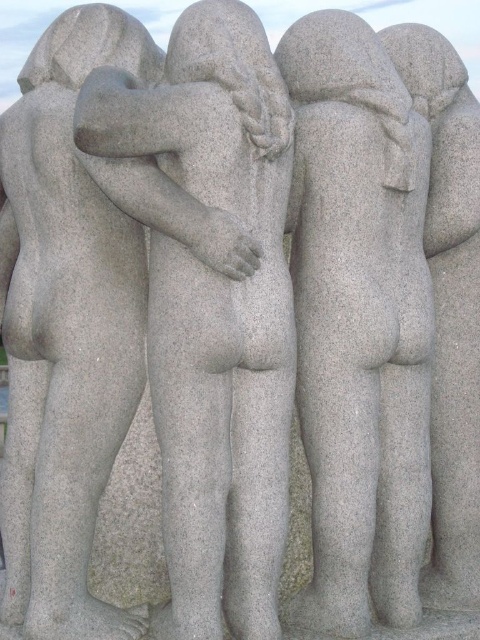
Consider the image. Is gray granite statue at center to the right of gray stone statue at center from the viewer's perspective?

Indeed, gray granite statue at center is positioned on the right side of gray stone statue at center.

In the scene shown: Who is shorter, gray granite statue at center or gray stone statue at center?

gray stone statue at center

This screenshot has height=640, width=480. Describe the element at coordinates (371, 294) in the screenshot. I see `gray granite statue at center` at that location.

Locate an element on the screen. gray granite statue at center is located at coordinates (371, 294).

Based on the photo, can you confirm if gray stone statue at center is positioned to the right of gray granite statue at left?

Yes, gray stone statue at center is to the right of gray granite statue at left.

Is gray stone statue at center thinner than gray granite statue at left?

No.

Between point (203, 484) and point (64, 221), which one is positioned behind?

Point (64, 221)

Identify the location of gray stone statue at center. This screenshot has height=640, width=480. (215, 314).

Can you confirm if gray granite statue at center is shorter than gray granite statue at left?

In fact, gray granite statue at center may be taller than gray granite statue at left.

Is point (386, 570) positioned after point (123, 278)?

Yes, it is behind point (123, 278).

Find the location of a particular element. The width and height of the screenshot is (480, 640). gray granite statue at center is located at coordinates (371, 294).